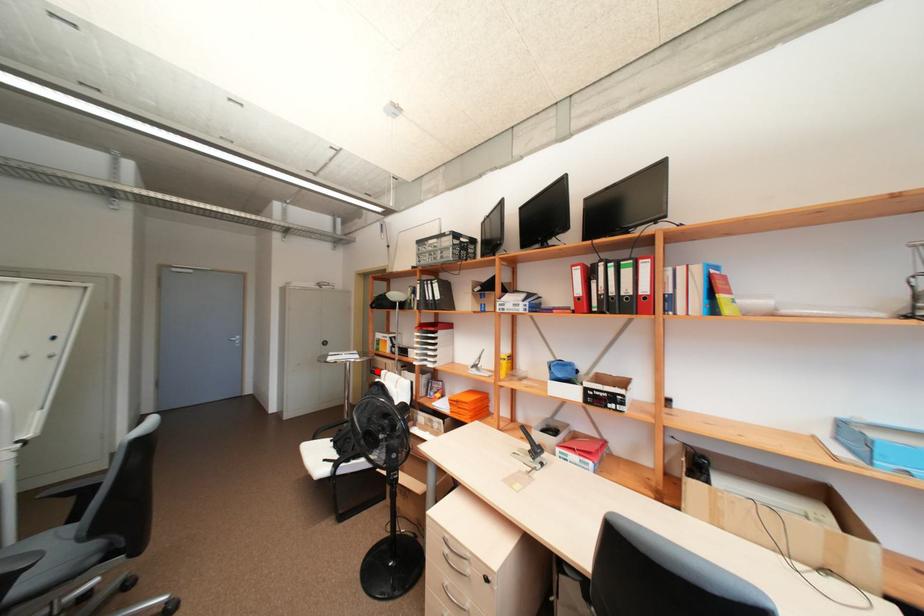
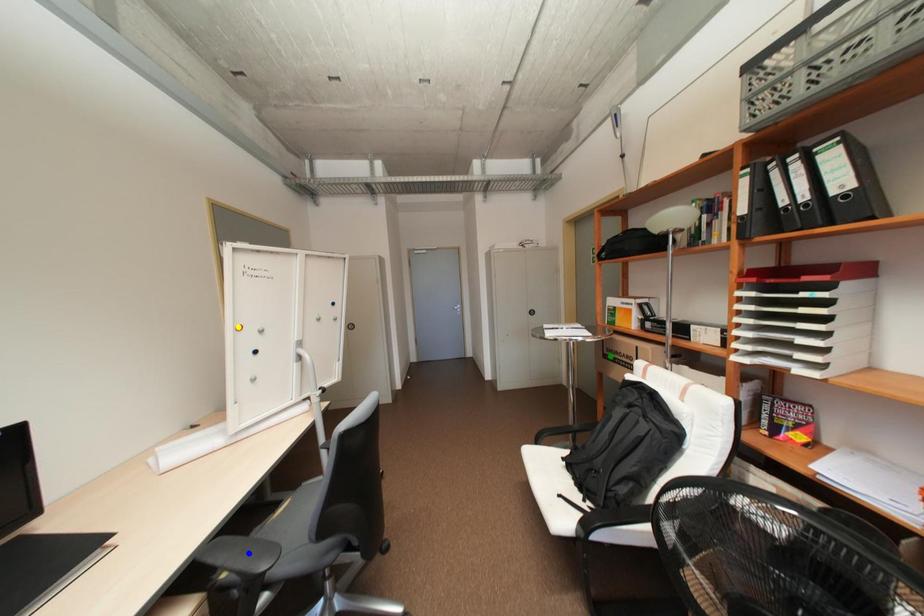
Question: I am providing you with two images of the same scene from different viewpoints. A red point is marked on the first image. You are given multiple points on the second image. Can you choose the point in image 2 that corresponds to the point in image 1?

Choices:
 (A) yellow point
 (B) blue point
 (C) green point

Answer: (C)